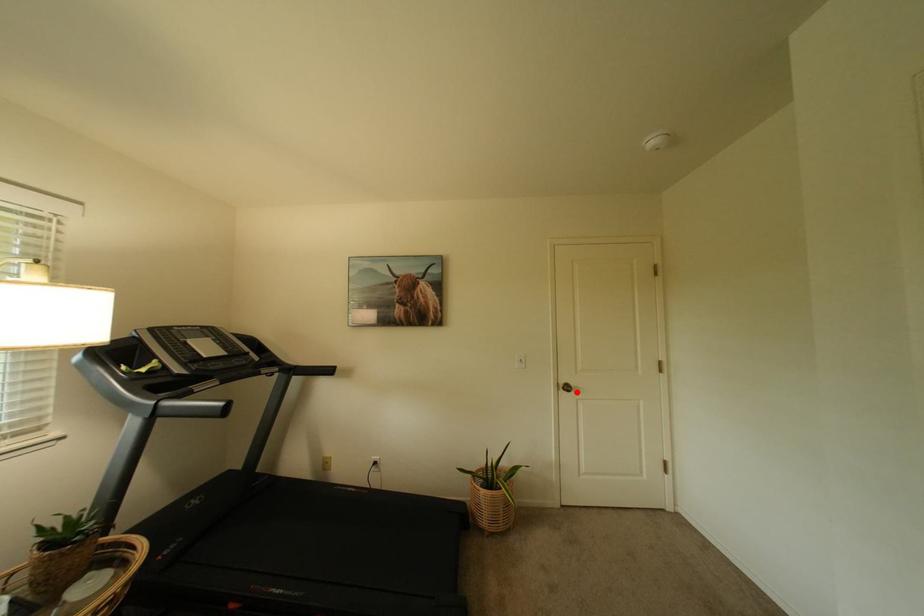
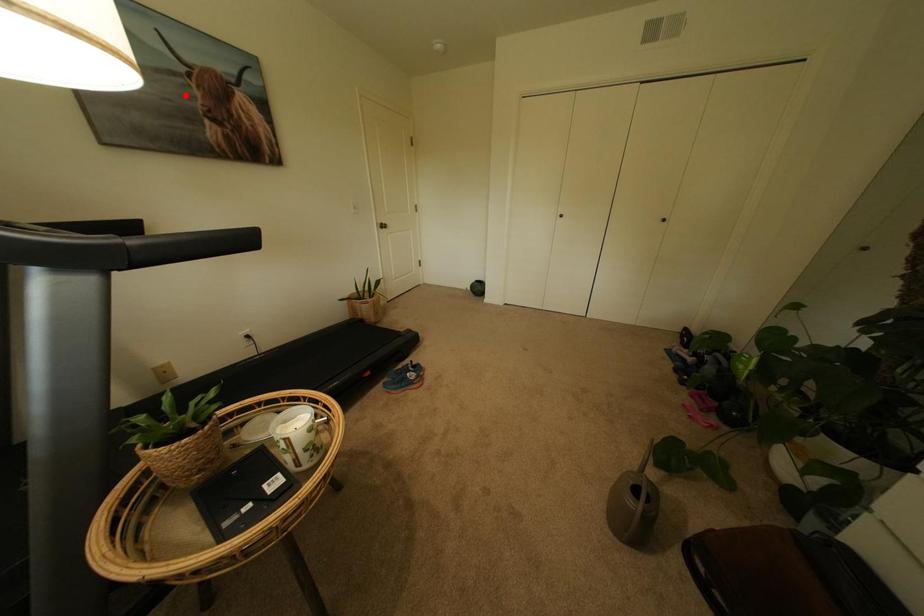
I am providing you with two images of the same scene from different viewpoints. A red point is marked on the first image and another point is marked on the second image. Do the highlighted points in image1 and image2 indicate the same real-world spot?

No